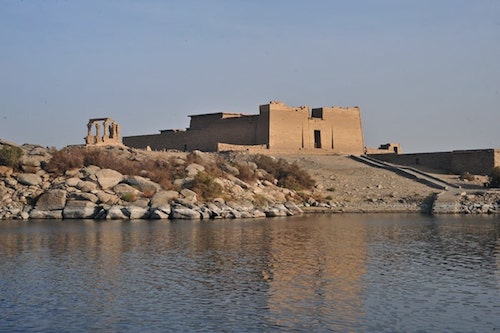
Locate an element on the screen. This screenshot has width=500, height=333. support pillar is located at coordinates (105, 127), (96, 127), (89, 129), (113, 129), (118, 130).